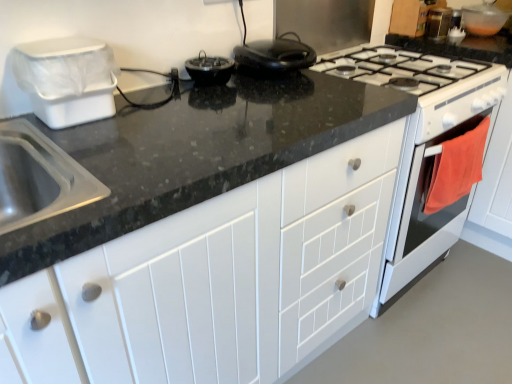
Question: Is white glossy oven at right, which appears as the 2th oven when viewed from the front, located within transparent plastic bowl at upper right, which is counted as the first appliance, starting from the back?

Choices:
 (A) no
 (B) yes

Answer: (A)

Question: Is transparent plastic bowl at upper right, which is counted as the first appliance, starting from the back, facing towards white glossy oven at right, the first oven viewed from the back?

Choices:
 (A) yes
 (B) no

Answer: (B)

Question: Does transparent plastic bowl at upper right, which is the first appliance in right-to-left order, have a lesser height compared to white glossy oven at right, which appears as the 2th oven when viewed from the front?

Choices:
 (A) yes
 (B) no

Answer: (A)

Question: Is transparent plastic bowl at upper right, placed as the third appliance when sorted from front to back, further to camera compared to white glossy oven at right, which appears as the 2th oven when viewed from the front?

Choices:
 (A) yes
 (B) no

Answer: (A)

Question: Is transparent plastic bowl at upper right, the 1th appliance from the top, positioned in front of white glossy oven at right, the first oven viewed from the back?

Choices:
 (A) no
 (B) yes

Answer: (A)

Question: From the image's perspective, is white glossy gas stove at upper right above or below white matte cabinet at center?

Choices:
 (A) above
 (B) below

Answer: (A)

Question: Considering the positions of white glossy gas stove at upper right and white matte cabinet at center in the image, is white glossy gas stove at upper right taller or shorter than white matte cabinet at center?

Choices:
 (A) short
 (B) tall

Answer: (A)

Question: Looking at the image, does white glossy gas stove at upper right seem bigger or smaller compared to white matte cabinet at center?

Choices:
 (A) small
 (B) big

Answer: (A)

Question: Is white glossy gas stove at upper right wider or thinner than white matte cabinet at center?

Choices:
 (A) wide
 (B) thin

Answer: (A)

Question: From a real-world perspective, relative to transparent plastic bowl at upper right, which is counted as the first appliance, starting from the back, is white matte cabinet at center vertically above or below?

Choices:
 (A) below
 (B) above

Answer: (A)

Question: Considering the positions of white matte cabinet at center and transparent plastic bowl at upper right, the third appliance from the bottom, in the image, is white matte cabinet at center taller or shorter than transparent plastic bowl at upper right, the third appliance from the bottom,?

Choices:
 (A) tall
 (B) short

Answer: (A)

Question: In terms of width, does white matte cabinet at center look wider or thinner when compared to transparent plastic bowl at upper right, placed as the third appliance when sorted from front to back?

Choices:
 (A) wide
 (B) thin

Answer: (A)

Question: In terms of size, does white matte cabinet at center appear bigger or smaller than transparent plastic bowl at upper right, the 1th appliance from the top?

Choices:
 (A) small
 (B) big

Answer: (B)

Question: Considering the positions of point pos(442,215) and point pos(394,59), is point pos(442,215) closer or farther from the camera than point pos(394,59)?

Choices:
 (A) farther
 (B) closer

Answer: (A)

Question: Based on their sizes in the image, would you say white glossy oven at right, the first oven viewed from the back, is bigger or smaller than white glossy gas stove at upper right?

Choices:
 (A) big
 (B) small

Answer: (A)